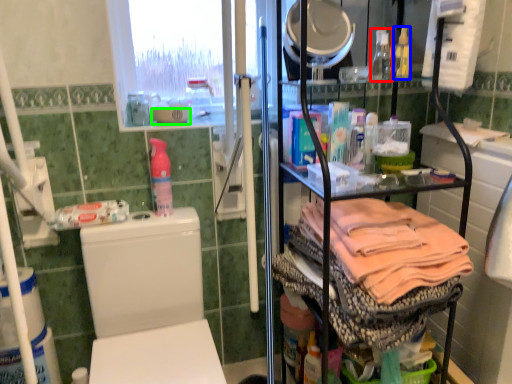
Question: Which object is positioned farthest from bottle (highlighted by a red box)? Select from bottle (highlighted by a blue box) and bowl (highlighted by a green box).

Choices:
 (A) bottle
 (B) bowl

Answer: (B)